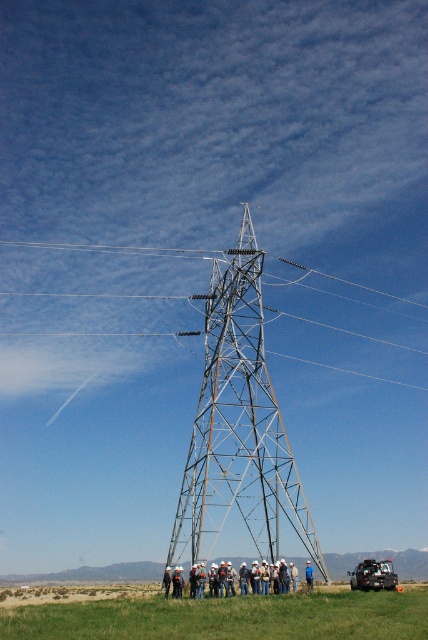
Question: Can you confirm if white hard hat at lower center is bigger than brushed metal jeep at lower center?

Choices:
 (A) yes
 (B) no

Answer: (A)

Question: Considering the relative positions of metallic silver tower at center and green grassy field at lower center in the image provided, where is metallic silver tower at center located with respect to green grassy field at lower center?

Choices:
 (A) above
 (B) below

Answer: (A)

Question: Which point is closer to the camera taking this photo?

Choices:
 (A) (210, 572)
 (B) (309, 572)

Answer: (A)

Question: Can you confirm if metallic silver tower at center is positioned above white hard hat at center?

Choices:
 (A) yes
 (B) no

Answer: (A)

Question: Estimate the real-world distances between objects in this image. Which object is farther from the white hard hat at lower center?

Choices:
 (A) white hard hat at center
 (B) metallic silver tower at center
 (C) brushed metal jeep at lower center
 (D) green grassy field at lower center

Answer: (C)

Question: Estimate the real-world distances between objects in this image. Which object is farther from the white hard hat at lower center?

Choices:
 (A) white hard hat at center
 (B) metallic silver tower at center
 (C) brushed metal jeep at lower center
 (D) green grassy field at lower center

Answer: (C)